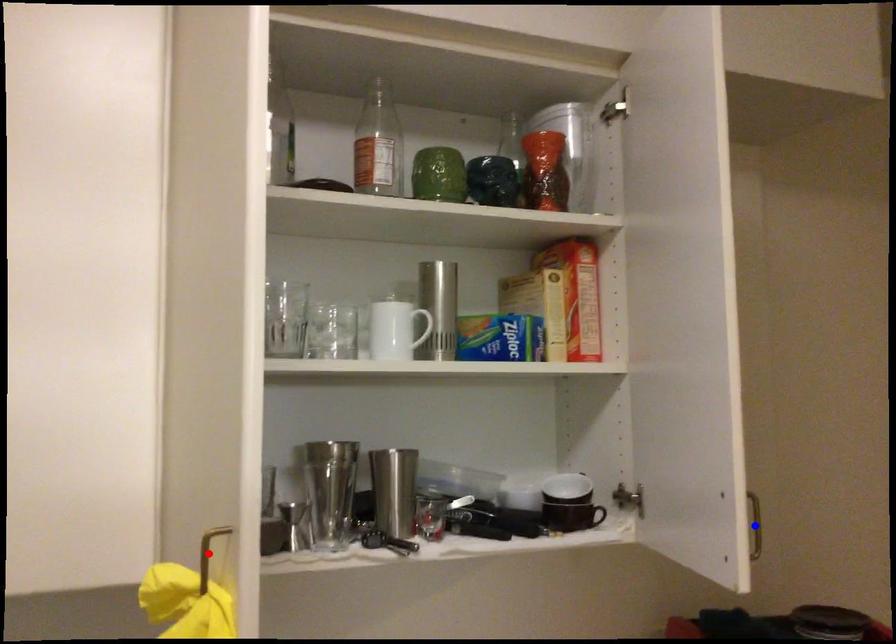
Question: Which of the two points in the image is closer to the camera?

Choices:
 (A) Blue point is closer.
 (B) Red point is closer.

Answer: (B)